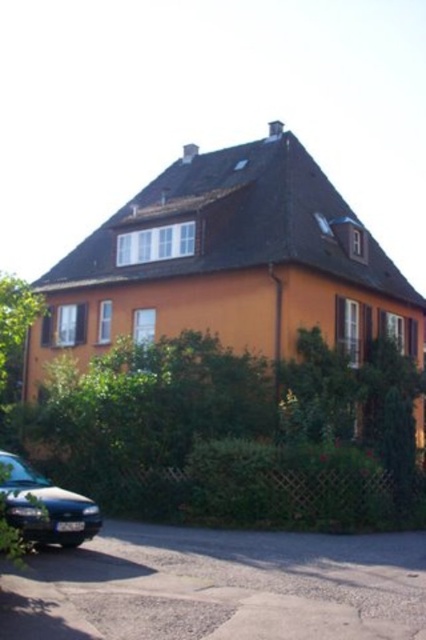
Question: Is green leafy hedge at center in front of gray asphalt driveway at lower left?

Choices:
 (A) yes
 (B) no

Answer: (B)

Question: Which of the following is the farthest from the observer?

Choices:
 (A) shiny black sedan at lower left
 (B) green leafy hedge at center

Answer: (B)

Question: Which object is the farthest from the shiny black sedan at lower left?

Choices:
 (A) green leafy hedge at center
 (B) gray asphalt driveway at lower left

Answer: (A)

Question: Is the position of gray asphalt driveway at lower left less distant than that of shiny black sedan at lower left?

Choices:
 (A) no
 (B) yes

Answer: (B)

Question: Can you confirm if gray asphalt driveway at lower left is wider than shiny black sedan at lower left?

Choices:
 (A) no
 (B) yes

Answer: (B)

Question: Which point is farther to the camera?

Choices:
 (A) gray asphalt driveway at lower left
 (B) shiny black sedan at lower left
 (C) green leafy hedge at center

Answer: (C)